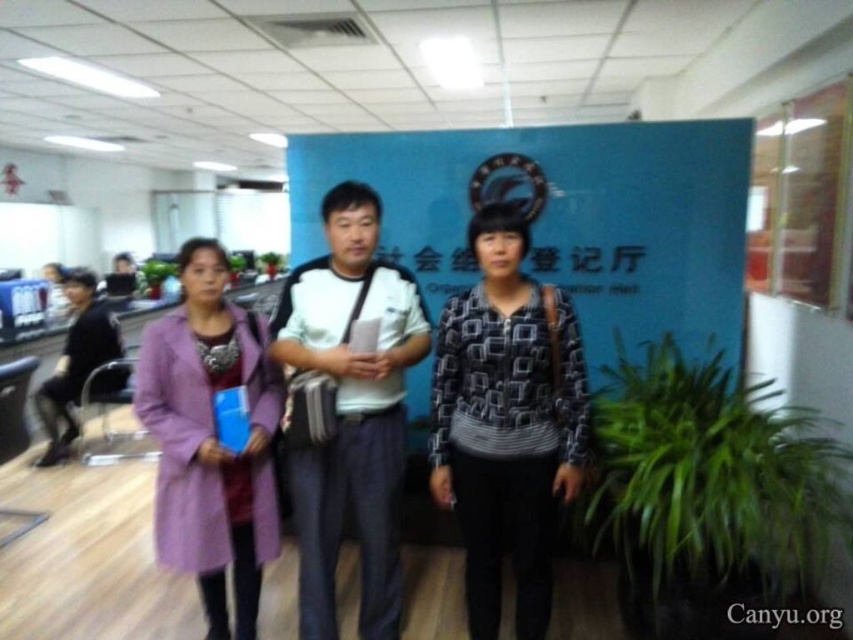
Who is more distant from viewer, (x=520, y=513) or (x=440, y=378)?

Positioned behind is point (x=440, y=378).

Does purple fabric coat at center have a greater height compared to patterned fabric jacket at center?

Correct, purple fabric coat at center is much taller as patterned fabric jacket at center.

Is point (291, 285) in front of point (479, 499)?

No, it is behind (479, 499).

You are a GUI agent. You are given a task and a screenshot of the screen. Output one action in this format:
    pyautogui.click(x=<x>, y=<y>)
    Task: Click on the purple fabric coat at center
    The height and width of the screenshot is (640, 853).
    Given the screenshot: What is the action you would take?
    pyautogui.click(x=351, y=413)

Who is more forward, (x=364, y=620) or (x=82, y=324)?

Point (x=364, y=620) is more forward.

Is purple fabric coat at center positioned in front of black shirt at left?

Yes.

Measure the distance between purple fabric coat at center and camera.

purple fabric coat at center and camera are 2.01 meters apart.

At what (x,y) coordinates should I click in order to perform the action: click on purple fabric coat at center. Please return your answer as a coordinate pair (x, y). This screenshot has width=853, height=640. Looking at the image, I should click on (351, 413).

Is point (363, 547) closer to camera compared to point (357, 214)?

No, it is behind (357, 214).

Does purple fabric coat at center have a lesser height compared to white cotton shirt at center?

Correct, purple fabric coat at center is not as tall as white cotton shirt at center.

Does point (494, 216) lie in front of point (352, 461)?

Yes, it is in front of point (352, 461).

Locate an element on the screen. This screenshot has height=640, width=853. purple fabric coat at center is located at coordinates (351, 413).